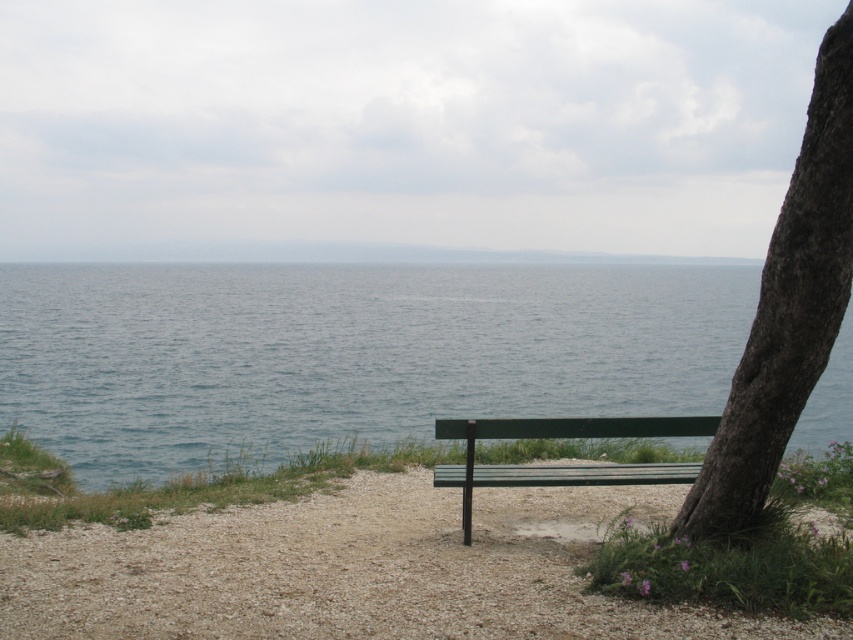
Question: Does blue water at center appear under green wooden bench at center?

Choices:
 (A) yes
 (B) no

Answer: (B)

Question: Which point is farther to the camera?

Choices:
 (A) green wood bench at center
 (B) blue water at center
 (C) dark brown textured bark at right

Answer: (B)

Question: Which is nearer to the dark brown textured bark at right?

Choices:
 (A) blue water at center
 (B) green wood bench at center
 (C) green wooden bench at center

Answer: (C)

Question: Does blue water at center come in front of dark brown textured bark at right?

Choices:
 (A) no
 (B) yes

Answer: (A)

Question: Can you confirm if dark brown textured bark at right is positioned to the right of green wooden bench at center?

Choices:
 (A) no
 (B) yes

Answer: (B)

Question: Which of the following is the farthest from the observer?

Choices:
 (A) (756, 362)
 (B) (306, 602)

Answer: (A)